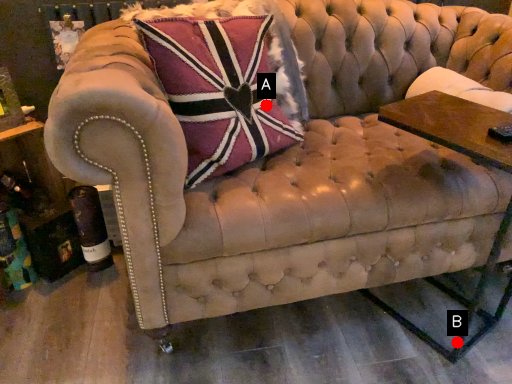
Question: Two points are circled on the image, labeled by A and B beside each circle. Which of the following is the closest to the observer?

Choices:
 (A) A is closer
 (B) B is closer

Answer: (A)